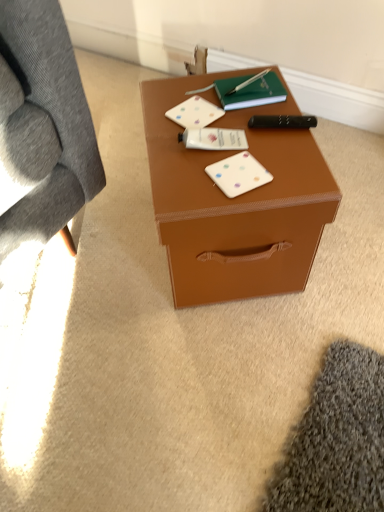
Question: Considering their positions, is white matte card game at center, which is counted as the 1th card game, starting from the top, located in front of or behind black plastic remote control at right?

Choices:
 (A) front
 (B) behind

Answer: (B)

Question: From a real-world perspective, is white matte card game at center, acting as the second card game starting from the front, above or below black plastic remote control at right?

Choices:
 (A) below
 (B) above

Answer: (A)

Question: Estimate the real-world distances between objects in this image. Which object is closer to the brown matte box at center?

Choices:
 (A) white matte card game at center, which ranks as the 2th card game in back-to-front order
 (B) black plastic remote control at right
 (C) white matte card game at center, which is counted as the 1th card game, starting from the top
 (D) green matte notebook at upper center

Answer: (A)

Question: Which object is positioned farthest from the brown matte box at center?

Choices:
 (A) green matte notebook at upper center
 (B) white matte card game at center, which is counted as the 1th card game, starting from the top
 (C) white matte card game at center, positioned as the first card game in front-to-back order
 (D) black plastic remote control at right

Answer: (A)